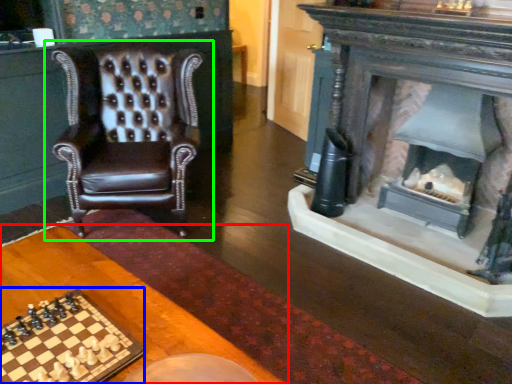
Question: Which is nearer to the table (highlighted by a red box)? board game (highlighted by a blue box) or chair (highlighted by a green box).

Choices:
 (A) board game
 (B) chair

Answer: (A)